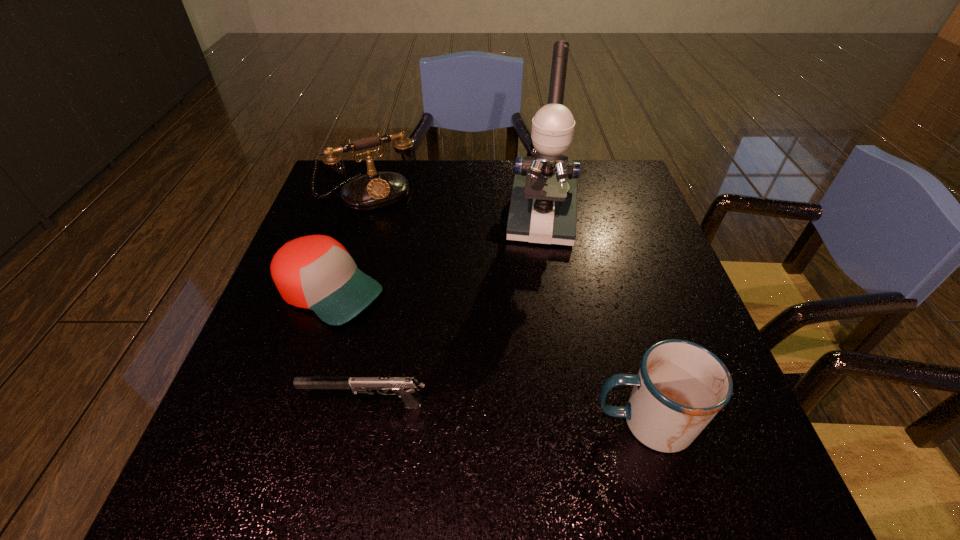
Locate an element on the screen. This screenshot has width=960, height=540. unoccupied position between the telephone and the microscope is located at coordinates (456, 207).

The height and width of the screenshot is (540, 960). Identify the location of vacant area that lies between the third shortest object and the gun. (506, 413).

Locate an element on the screen. free spot between the second shortest object and the telephone is located at coordinates coord(349,242).

The image size is (960, 540). Identify the location of empty location between the third farthest object and the shortest object. (348, 348).

Where is `free space between the third shortest object and the gun`? This screenshot has height=540, width=960. free space between the third shortest object and the gun is located at coordinates (506, 413).

You are a GUI agent. You are given a task and a screenshot of the screen. Output one action in this format:
    pyautogui.click(x=<x>, y=<y>)
    Task: Click on the vacant area between the microscope and the telephone
    
    Given the screenshot: What is the action you would take?
    pyautogui.click(x=456, y=207)

Choose which object is the fourth nearest neighbor to the mug. Please provide its 2D coordinates. Your answer should be formatted as a tuple, i.e. [(x, y)], where the tuple contains the x and y coordinates of a point satisfying the conditions above.

[(375, 190)]

Locate which object ranks fourth in proximity to the tallest object. Please provide its 2D coordinates. Your answer should be formatted as a tuple, i.e. [(x, y)], where the tuple contains the x and y coordinates of a point satisfying the conditions above.

[(405, 387)]

You are a GUI agent. You are given a task and a screenshot of the screen. Output one action in this format:
    pyautogui.click(x=<x>, y=<y>)
    Task: Click on the vacant space that satisfies the following two spatial constraints: 1. on the front side of the shortest object; 2. at the muzzle end of the baseball cap
    Image resolution: width=960 pixels, height=540 pixels.
    Given the screenshot: What is the action you would take?
    pyautogui.click(x=292, y=404)

Locate an element on the screen. The image size is (960, 540). free region that satisfies the following two spatial constraints: 1. on the front side of the baseball cap; 2. at the muzzle end of the gun is located at coordinates (292, 404).